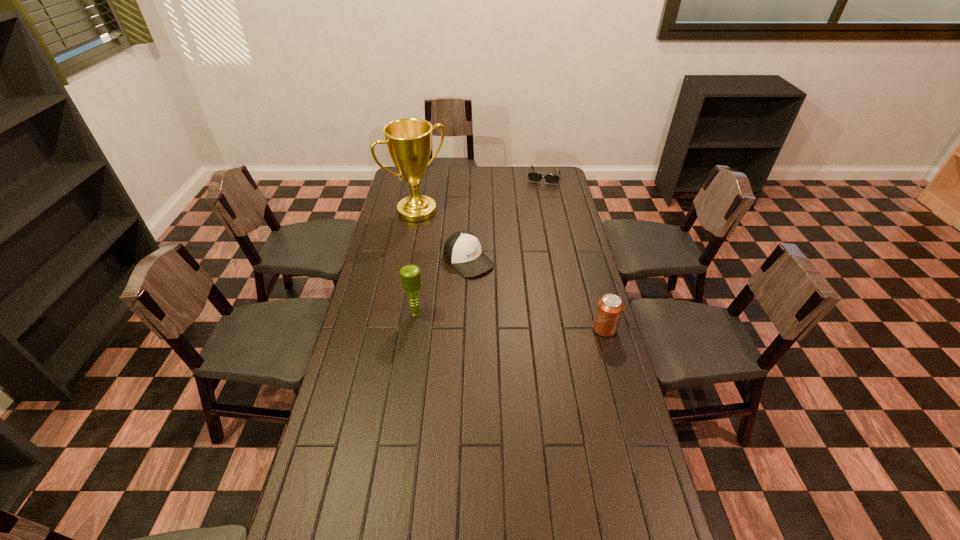
At what (x,y) coordinates should I click in order to perform the action: click on microphone. Please return your answer as a coordinate pair (x, y). Looking at the image, I should click on (410, 274).

Locate an element on the screen. The height and width of the screenshot is (540, 960). can is located at coordinates (x=609, y=309).

Find the location of a particular element. The width and height of the screenshot is (960, 540). sunglasses is located at coordinates (532, 176).

Identify the location of the farthest object. The width and height of the screenshot is (960, 540). (532, 176).

What are the coordinates of `the third farthest object` in the screenshot? It's located at (462, 250).

At what (x,y) coordinates should I click in order to perform the action: click on the third object from right to left. Please return your answer as a coordinate pair (x, y). This screenshot has width=960, height=540. Looking at the image, I should click on (462, 250).

The height and width of the screenshot is (540, 960). I want to click on the fourth nearest object, so click(409, 140).

This screenshot has width=960, height=540. Find the location of `the tallest object`. the tallest object is located at coordinates (409, 140).

Identify the location of vacant region located 0.390m on the back of the fourth shortest object. (426, 244).

Where is `vacant space located 0.070m on the front of the third shortest object`? The image size is (960, 540). vacant space located 0.070m on the front of the third shortest object is located at coordinates (612, 354).